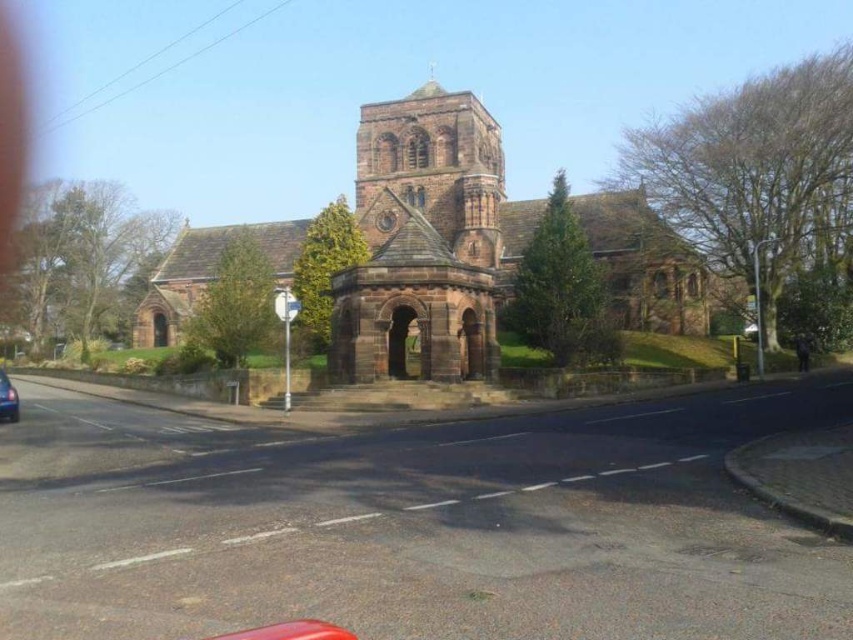
In the scene shown: You are a driver approaching the brown stone tower at center and the metallic silver car at center. Which object is closer to the left side of the road?

The brown stone tower at center is to the left of the metallic silver car at center, so it is closer to the left side of the road.

You are a tourist standing on the road in front of the brown stone church at center and the brown stone tower at center. Which structure is closer to you?

The brown stone church at center is closer to you because the brown stone tower at center is behind it.